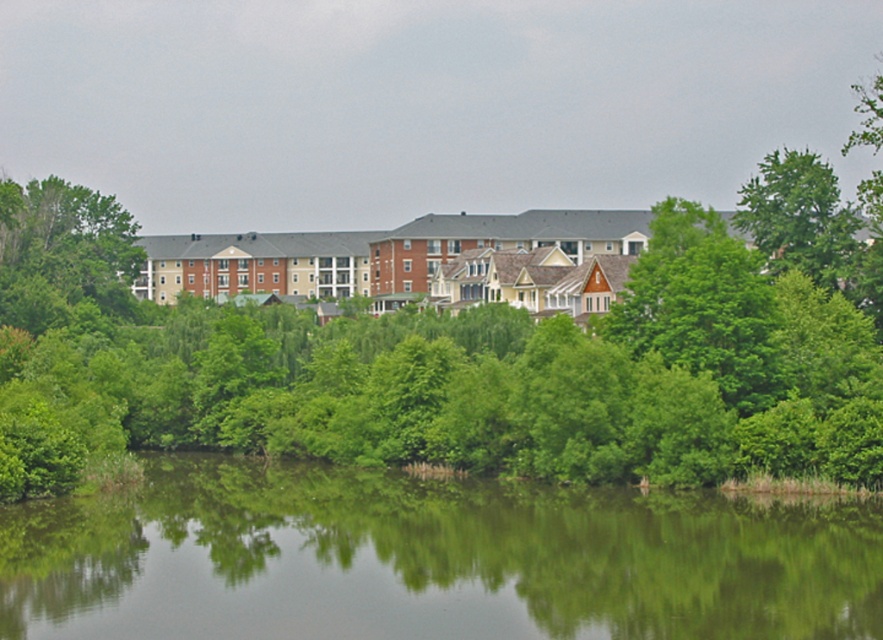
You are a landscape architect designing a new park. You have to decide where to place a new bench. The bench must be placed closer to the green leafy tree at center than to the green reflective water at center. Based on the scene, where should you place the bench?

The green leafy tree at center is wider than the green reflective water at center. To place the bench closer to the tree, position it near the tree, ensuring it is within the tree area and away from the water.

You are planning to take a photo of the suburban landscape. You want to ensure both the green reflective water at center and the green leafy tree at upper right are clearly visible. Which object should you focus on first to ensure both are in frame?

You should focus on the green leafy tree at upper right first because it is larger than the green reflective water at center, ensuring it fits within the frame while the smaller water area can be adjusted accordingly.